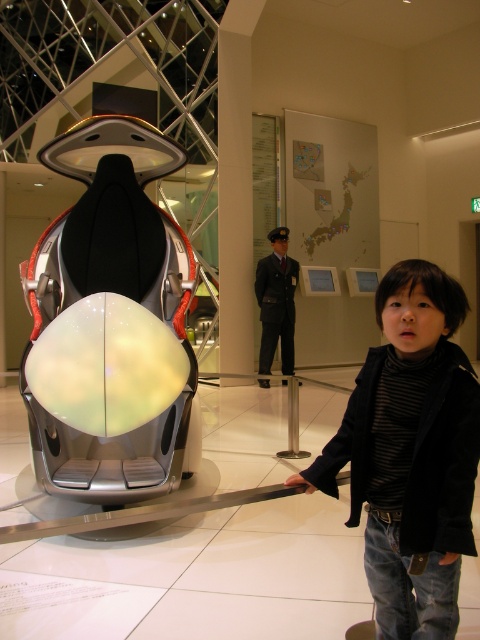
Between glossy metallic seat at center and black turtleneck sweater at right, which one appears on the left side from the viewer's perspective?

glossy metallic seat at center is more to the left.

The image size is (480, 640). What do you see at coordinates (110, 323) in the screenshot?
I see `glossy metallic seat at center` at bounding box center [110, 323].

Is point (80, 324) in front of point (453, 500)?

No.

You are a GUI agent. You are given a task and a screenshot of the screen. Output one action in this format:
    pyautogui.click(x=<x>, y=<y>)
    Task: Click on the glossy metallic seat at center
    The image size is (480, 640).
    Given the screenshot: What is the action you would take?
    pyautogui.click(x=110, y=323)